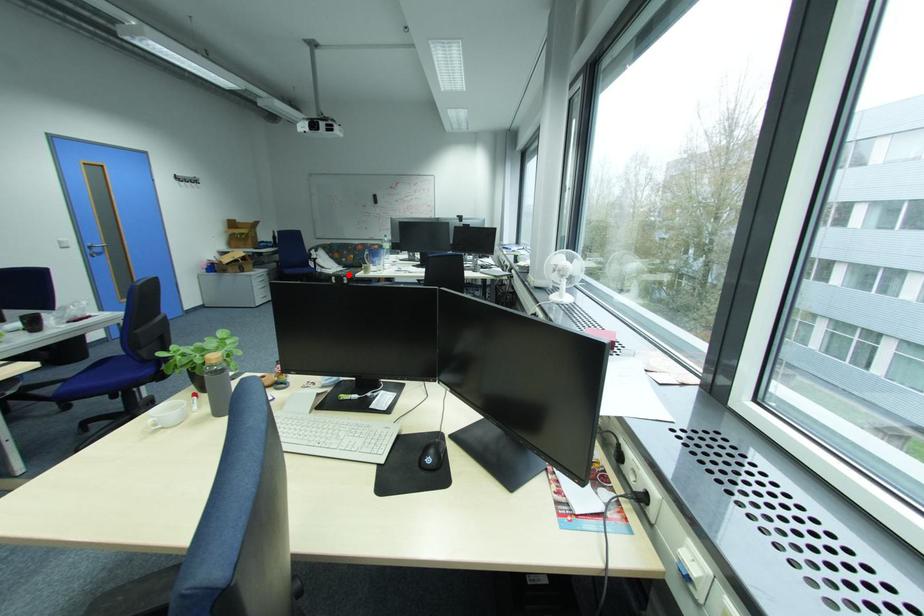
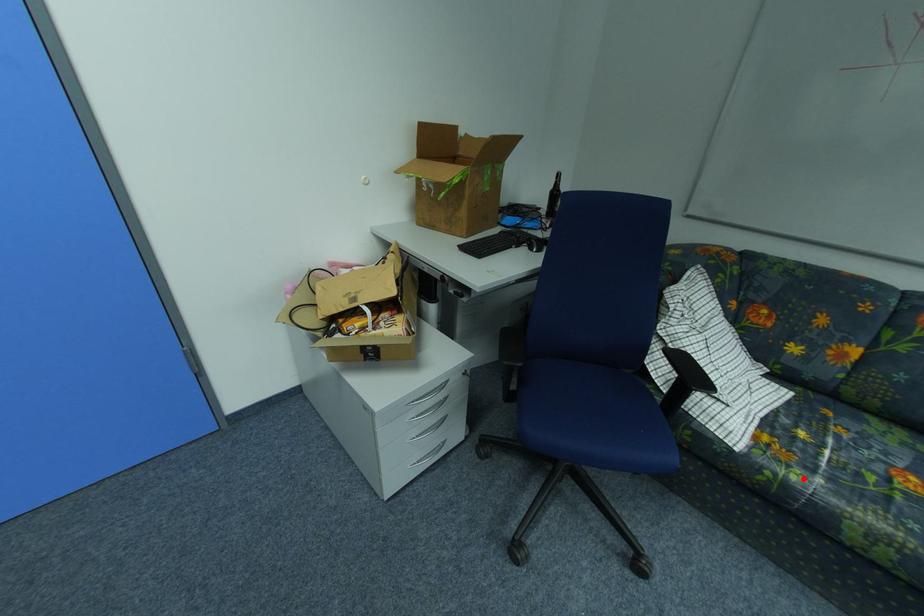
I am providing you with two images of the same scene from different viewpoints. A red point is marked on the first image and another point is marked on the second image. Are the points marked in image1 and image2 representing the same 3D position?

Yes